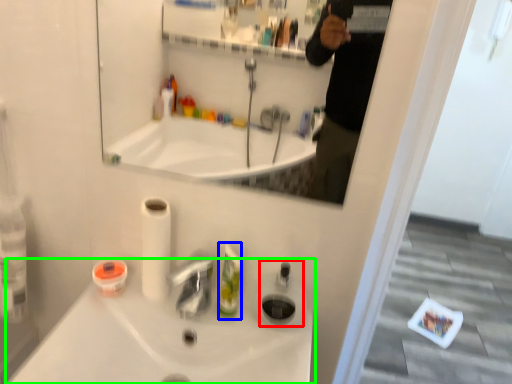
Question: Which object is positioned closest to soap dispenser (highlighted by a red box)? Select from mouthwash (highlighted by a blue box) and sink (highlighted by a green box).

Choices:
 (A) mouthwash
 (B) sink

Answer: (A)